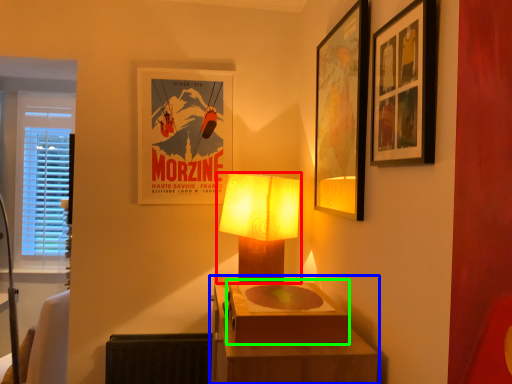
Question: Based on their relative distances, which object is nearer to lamp (highlighted by a red box)? Choose from table (highlighted by a blue box) and box (highlighted by a green box).

Choices:
 (A) table
 (B) box

Answer: (A)